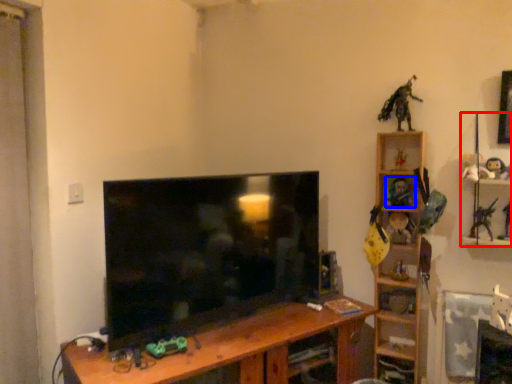
Question: Which object is closer to the camera taking this photo, toy (highlighted by a red box) or toy (highlighted by a blue box)?

Choices:
 (A) toy
 (B) toy

Answer: (A)